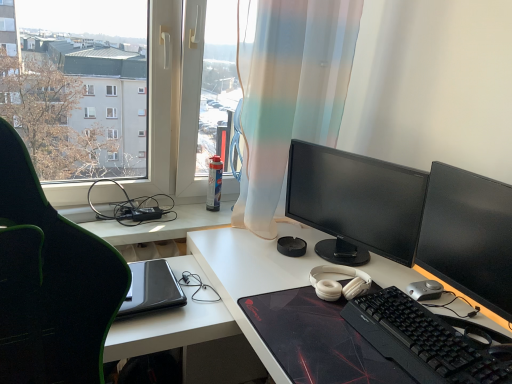
Question: Is transparent plastic window at upper left inside matte black monitor at center, positioned as the 2th computer monitor in front-to-back order?

Choices:
 (A) yes
 (B) no

Answer: (B)

Question: Is matte black monitor at center, positioned as the 2th computer monitor in front-to-back order, further to the viewer compared to transparent plastic window at upper left?

Choices:
 (A) yes
 (B) no

Answer: (A)

Question: From a real-world perspective, is matte black monitor at center, positioned as the 2th computer monitor in front-to-back order, positioned over transparent plastic window at upper left based on gravity?

Choices:
 (A) no
 (B) yes

Answer: (A)

Question: Considering the relative positions of matte black monitor at center, the 1th computer monitor when ordered from back to front, and transparent plastic window at upper left in the image provided, is matte black monitor at center, the 1th computer monitor when ordered from back to front, to the left of transparent plastic window at upper left from the viewer's perspective?

Choices:
 (A) no
 (B) yes

Answer: (A)

Question: Can you confirm if matte black monitor at center, positioned as the 2th computer monitor in front-to-back order, is bigger than transparent plastic window at upper left?

Choices:
 (A) no
 (B) yes

Answer: (A)

Question: Considering the relative sizes of matte black monitor at center, the 1th computer monitor when ordered from back to front, and transparent plastic window at upper left in the image provided, is matte black monitor at center, the 1th computer monitor when ordered from back to front, thinner than transparent plastic window at upper left?

Choices:
 (A) no
 (B) yes

Answer: (A)

Question: Is black matte desk at center inside translucent fabric curtain at center?

Choices:
 (A) yes
 (B) no

Answer: (B)

Question: From the image's perspective, does translucent fabric curtain at center appear lower than black matte desk at center?

Choices:
 (A) yes
 (B) no

Answer: (B)

Question: Can we say translucent fabric curtain at center lies outside black matte desk at center?

Choices:
 (A) yes
 (B) no

Answer: (A)

Question: Is translucent fabric curtain at center wider than black matte desk at center?

Choices:
 (A) yes
 (B) no

Answer: (B)

Question: Can you confirm if translucent fabric curtain at center is thinner than black matte desk at center?

Choices:
 (A) yes
 (B) no

Answer: (A)

Question: Is the position of translucent fabric curtain at center more distant than that of black matte desk at center?

Choices:
 (A) no
 (B) yes

Answer: (B)

Question: Is translucent fabric curtain at center bigger than silver metallic mouse at lower right?

Choices:
 (A) yes
 (B) no

Answer: (A)